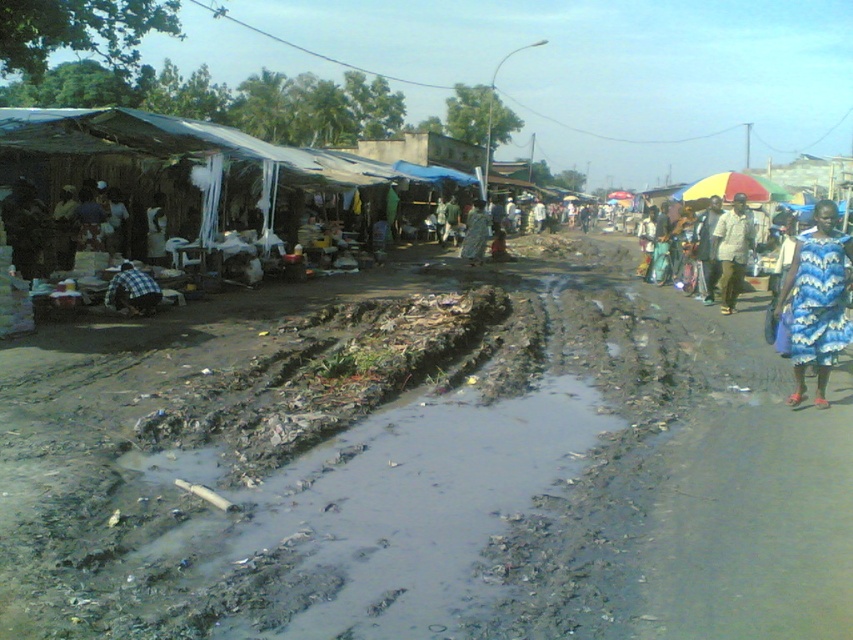
Question: Is blue printed dress at lower right bigger than blue printed dress at center?

Choices:
 (A) yes
 (B) no

Answer: (B)

Question: Which object is positioned farthest from the blue printed dress at lower right?

Choices:
 (A) checkered fabric shirt at left
 (B) blue printed dress at center

Answer: (B)

Question: Estimate the real-world distances between objects in this image. Which object is closer to the light brown fabric pants at right?

Choices:
 (A) blue printed dress at center
 (B) multicolored fabric umbrella at right

Answer: (A)

Question: Is light brown fabric pants at right bigger than blue printed dress at center?

Choices:
 (A) yes
 (B) no

Answer: (B)

Question: Does light brown fabric pants at right have a smaller size compared to blue printed dress at center?

Choices:
 (A) yes
 (B) no

Answer: (A)

Question: Which object appears farthest from the camera in this image?

Choices:
 (A) blue printed dress at lower right
 (B) checkered fabric shirt at left
 (C) blue printed dress at center

Answer: (C)